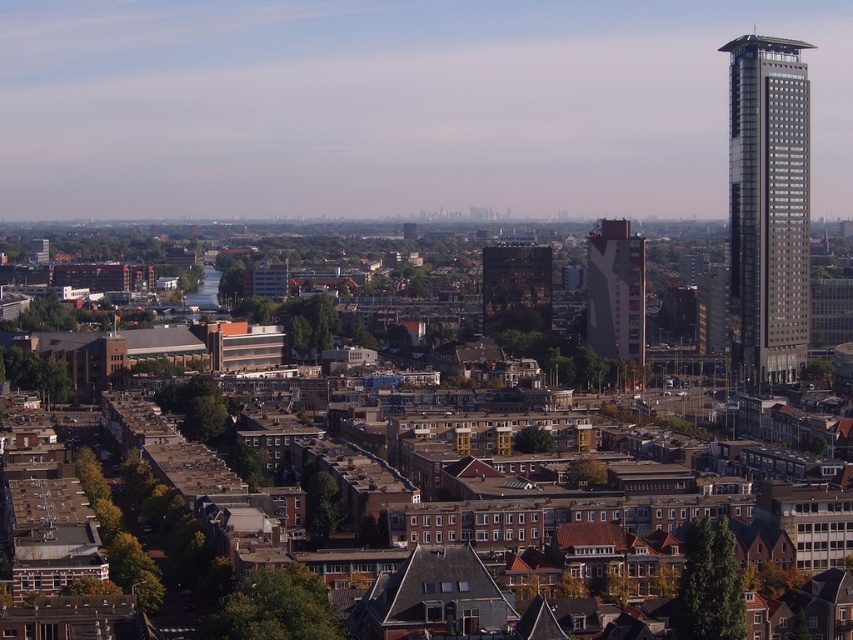
You are standing at the edge of the city park and see the red brick building at center and the dark brown brick building at center. You want to walk to both buildings to take photos. Which building should you walk to first to minimize the total distance you walk?

You should walk to the red brick building at center first, then the dark brown brick building at center because they are only 82.94 feet apart, so the total distance walked will be minimized by visiting them in either order since the distance between them is fixed.

You are an urban planner evaluating the city layout. Considering the silver metallic skyscraper at right and the dark brown brick building at center, which one would require more space for construction? Please explain your reasoning based on their sizes.

The silver metallic skyscraper at right requires more space for construction because it is larger in size than the dark brown brick building at center, as stated in the description.

Looking at this image, you are a drone operator tasked with flying a drone between the silver metallic skyscraper at right and the red brick building at center. The drone has a maximum flight distance of 30 meters. Can the drone safely fly between these two buildings without exceeding its range?

The silver metallic skyscraper at right is 29.32 meters away from the red brick building at center. Since the drone has a maximum flight distance of 30 meters, it can safely fly between them as the distance is within the drone